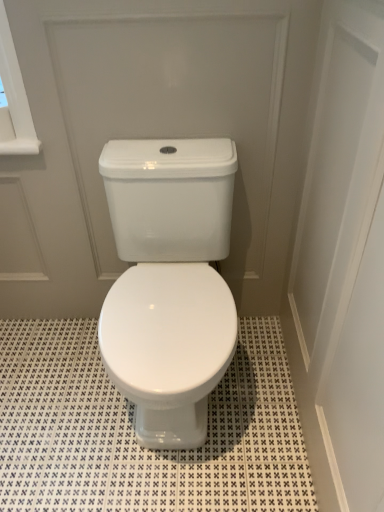
Identify the location of empty space that is ontop of white glossy tile at center. (102, 409).